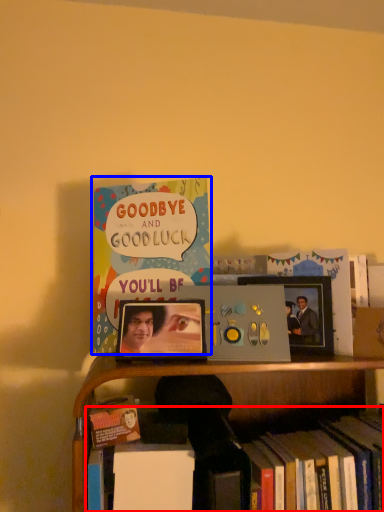
Question: Which object appears farthest to the camera in this image, book (highlighted by a red box) or book (highlighted by a blue box)?

Choices:
 (A) book
 (B) book

Answer: (B)